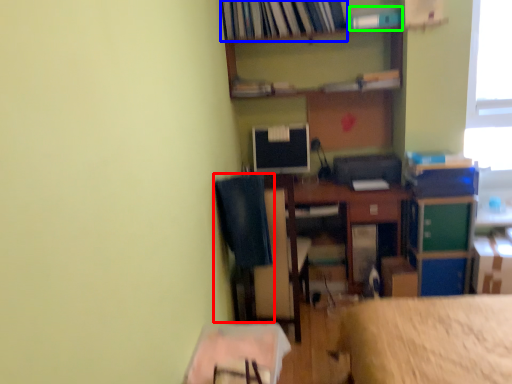
Question: Which object is the closest to the computer chair (highlighted by a red box)? Choose among these: book (highlighted by a blue box) or book (highlighted by a green box).

Choices:
 (A) book
 (B) book

Answer: (A)